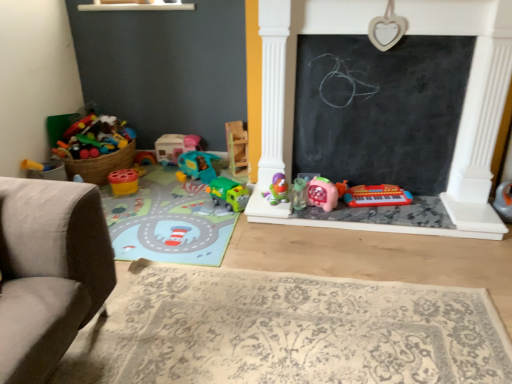
This screenshot has width=512, height=384. In order to click on blank space to the left of green plastic truck at center, which ranks as the 4th toy in left-to-right order in this screenshot , I will do `click(199, 204)`.